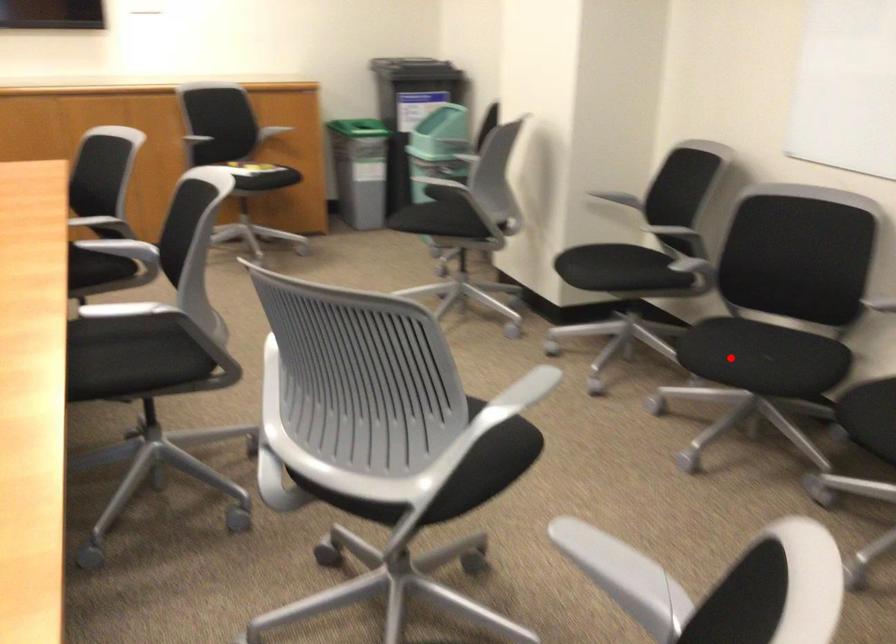
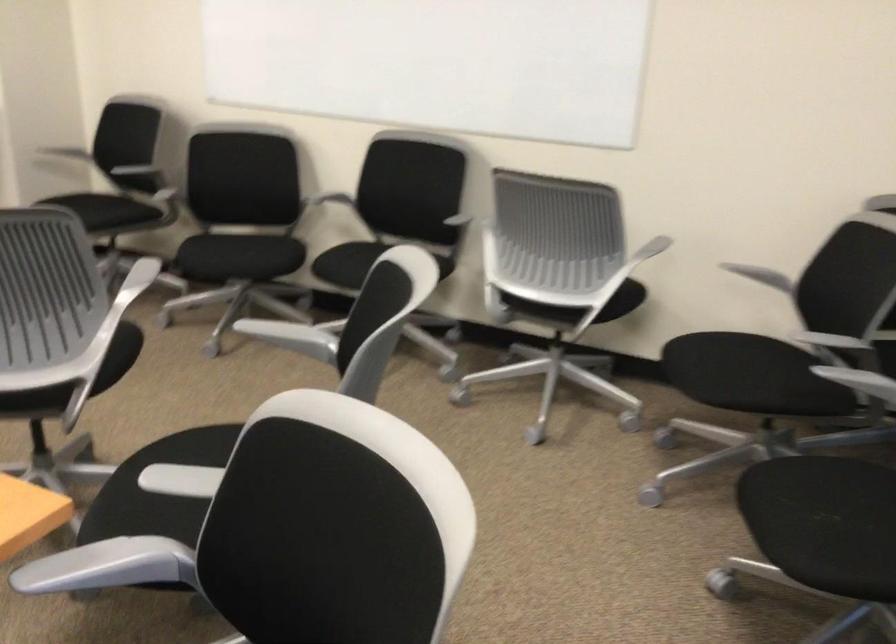
Where in the second image is the point corresponding to the highlighted location from the first image?

(237, 257)